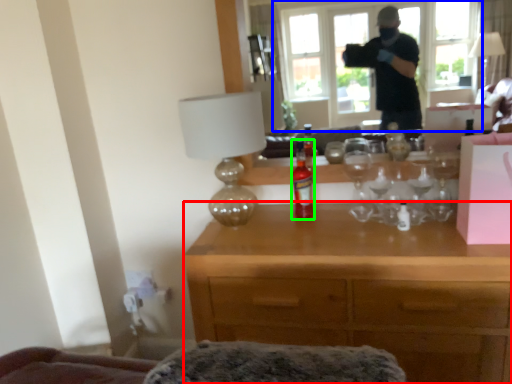
Question: Which object is the closest to the desk (highlighted by a red box)? Choose among these: window (highlighted by a blue box) or bottle (highlighted by a green box).

Choices:
 (A) window
 (B) bottle

Answer: (B)